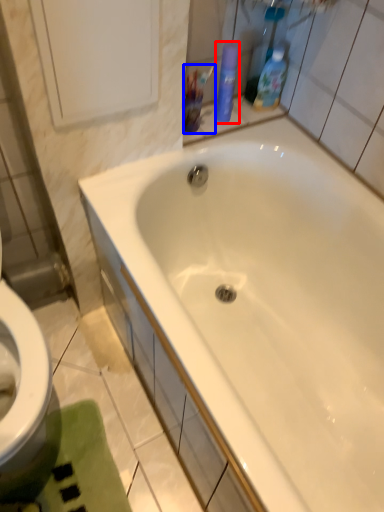
Question: Which object is further to the camera taking this photo, cleaning product (highlighted by a red box) or mouthwash (highlighted by a blue box)?

Choices:
 (A) cleaning product
 (B) mouthwash

Answer: (A)